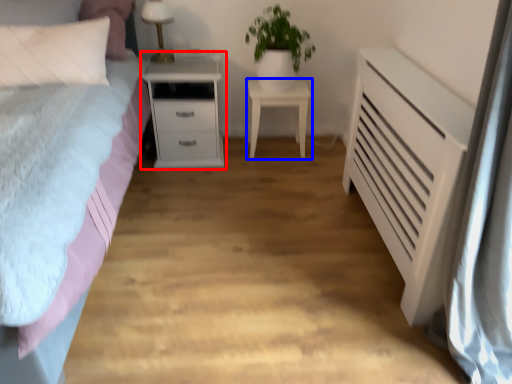
Question: Which object is further to the camera taking this photo, nightstand (highlighted by a red box) or nightstand (highlighted by a blue box)?

Choices:
 (A) nightstand
 (B) nightstand

Answer: (B)